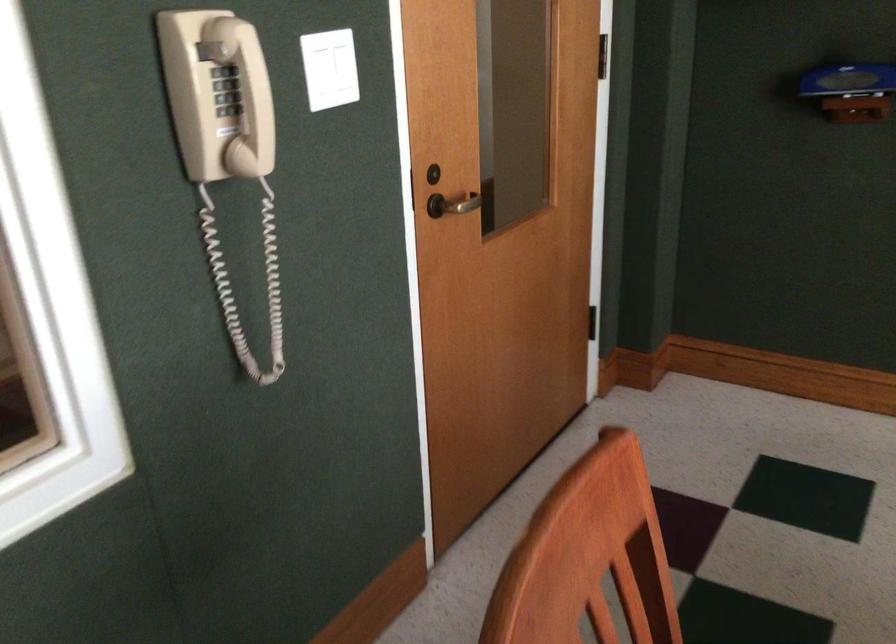
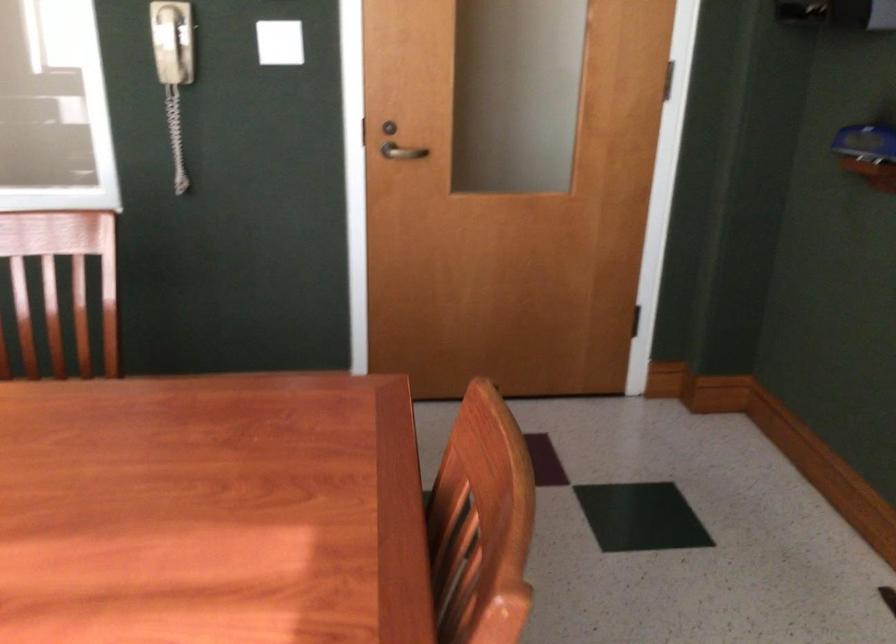
Locate, in the second image, the point that corresponds to point (247, 79) in the first image.

(171, 41)